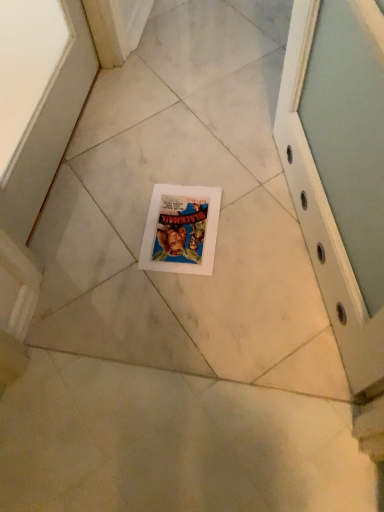
In order to click on white paper comic book at center in this screenshot , I will do `click(181, 229)`.

The width and height of the screenshot is (384, 512). Describe the element at coordinates (181, 229) in the screenshot. I see `white paper comic book at center` at that location.

Measure the distance between point (165, 194) and camera.

The distance of point (165, 194) from camera is 1.28 meters.

Where is `white paper comic book at center`? white paper comic book at center is located at coordinates (181, 229).